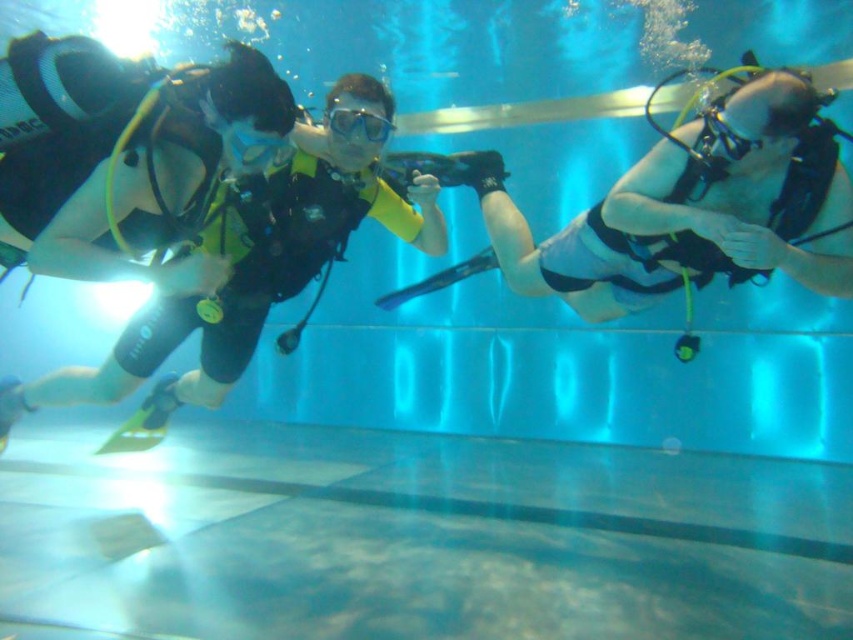
Consider the image. Between black matte scuba diver at center and clear plastic goggles at center, which one has less height?

With less height is clear plastic goggles at center.

Which is behind, point (299, 188) or point (335, 120)?

Positioned behind is point (299, 188).

You are a GUI agent. You are given a task and a screenshot of the screen. Output one action in this format:
    pyautogui.click(x=<x>, y=<y>)
    Task: Click on the black matte scuba diver at center
    This screenshot has width=853, height=640.
    Given the screenshot: What is the action you would take?
    pyautogui.click(x=241, y=282)

Between matte black scuba gear at center and transparent rubber goggles at center, which one has less height?

transparent rubber goggles at center is shorter.

Is matte black scuba gear at center to the left of transparent rubber goggles at center from the viewer's perspective?

Indeed, matte black scuba gear at center is positioned on the left side of transparent rubber goggles at center.

Between point (717, 179) and point (717, 145), which one is positioned in front?

Point (717, 145) is in front.

Where is `matte black scuba gear at center`? The width and height of the screenshot is (853, 640). matte black scuba gear at center is located at coordinates (693, 209).

Who is lower down, black matte scuba diver at center or transparent rubber goggles at center?

black matte scuba diver at center is below.

Is black matte scuba diver at center positioned in front of transparent rubber goggles at center?

That is False.

Identify the location of black matte scuba diver at center. This screenshot has width=853, height=640. (241, 282).